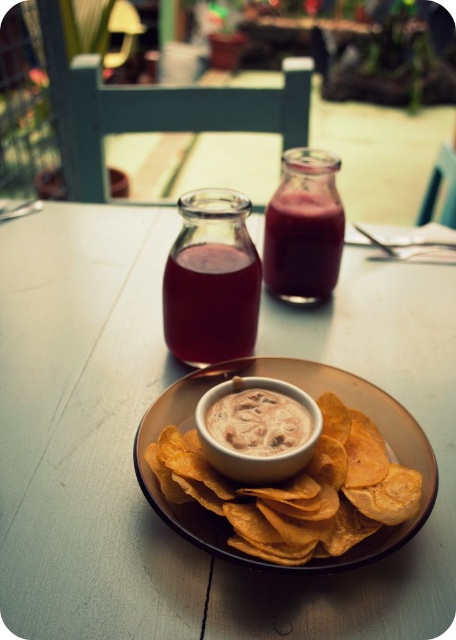
You are a delivery person who needs to place a small package on the wooden table at center. According to the coordinates provided, where exactly should you place it?

The wooden table at center is located at coordinates point (146, 406), so place the package there.